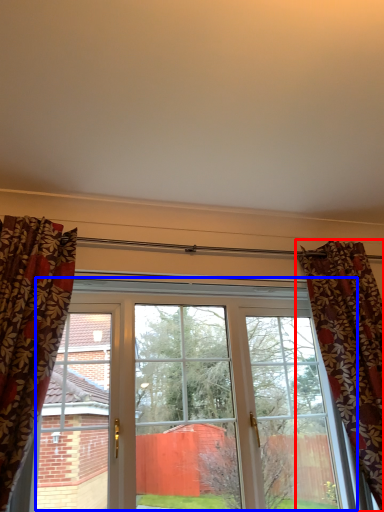
Question: Which of the following is the farthest to the observer, curtain (highlighted by a red box) or window (highlighted by a blue box)?

Choices:
 (A) curtain
 (B) window

Answer: (B)